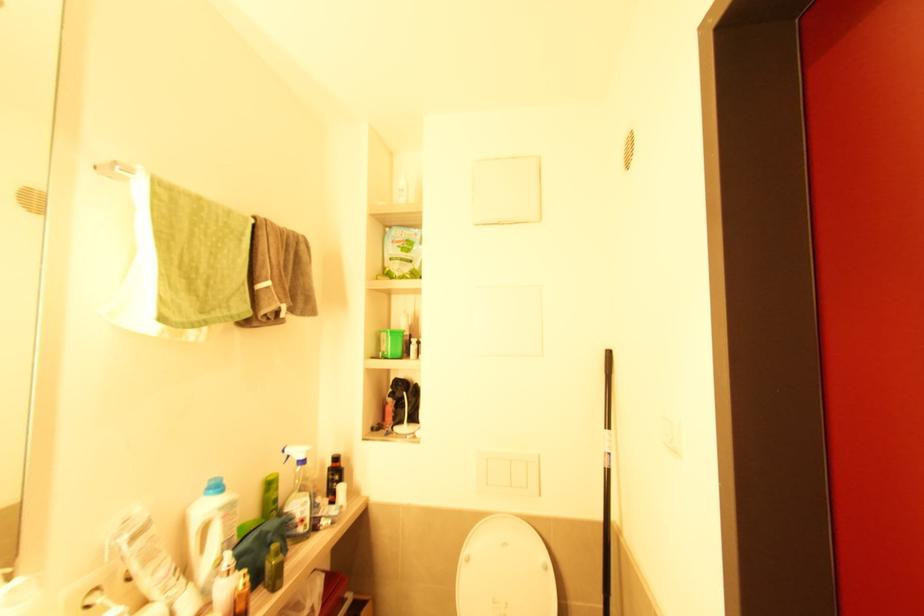
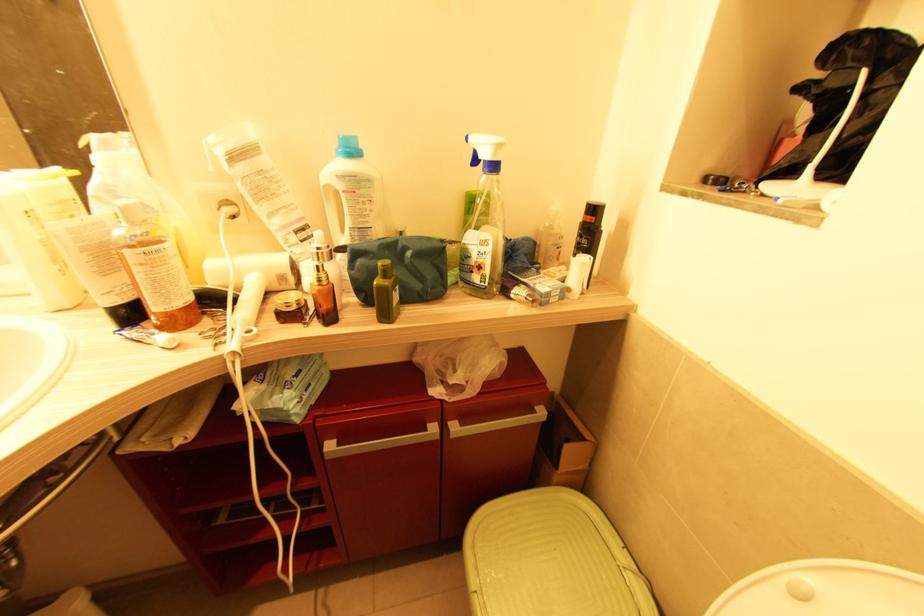
Find the pixel in the second image that matches pixel 278 554 in the first image.

(386, 278)